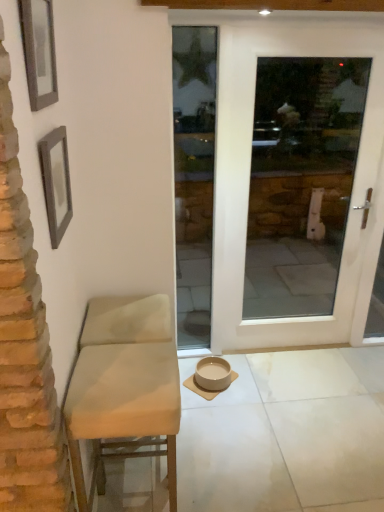
Question: From their relative heights in the image, would you say wooden picture frame at upper left, the first picture frame in the top-to-bottom sequence, is taller or shorter than beige ceramic bowl at center?

Choices:
 (A) short
 (B) tall

Answer: (B)

Question: Is wooden picture frame at upper left, which is the second picture frame from bottom to top, bigger or smaller than beige ceramic bowl at center?

Choices:
 (A) big
 (B) small

Answer: (B)

Question: Which object is the closest to the beige ceramic bowl at center?

Choices:
 (A) beige matte tile at center
 (B) wooden picture frame at upper left, which is the second picture frame from bottom to top
 (C) beige fabric chair at left
 (D) white glossy door at center
 (E) gray textured frame at upper left, the second picture frame when ordered from top to bottom

Answer: (A)

Question: Which object is positioned closest to the white glossy door at center?

Choices:
 (A) wooden picture frame at upper left, which is the second picture frame from bottom to top
 (B) beige fabric chair at left
 (C) beige matte tile at center
 (D) gray textured frame at upper left, the second picture frame when ordered from top to bottom
 (E) beige ceramic bowl at center

Answer: (C)